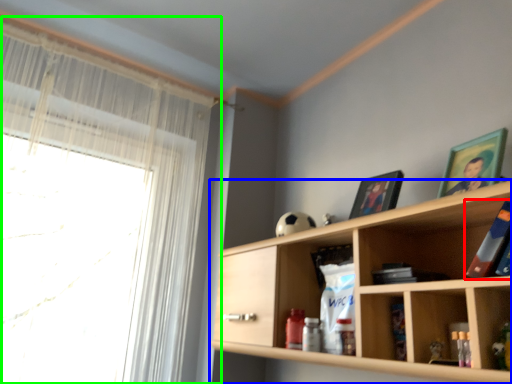
Question: Based on their relative distances, which object is nearer to book (highlighted by a red box)? Choose from shelf (highlighted by a blue box) and window (highlighted by a green box).

Choices:
 (A) shelf
 (B) window

Answer: (A)